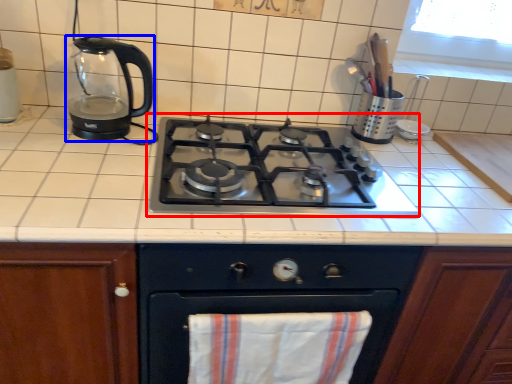
Question: Which of the following is the closest to the observer, gas stove (highlighted by a red box) or kitchen appliance (highlighted by a blue box)?

Choices:
 (A) gas stove
 (B) kitchen appliance

Answer: (A)